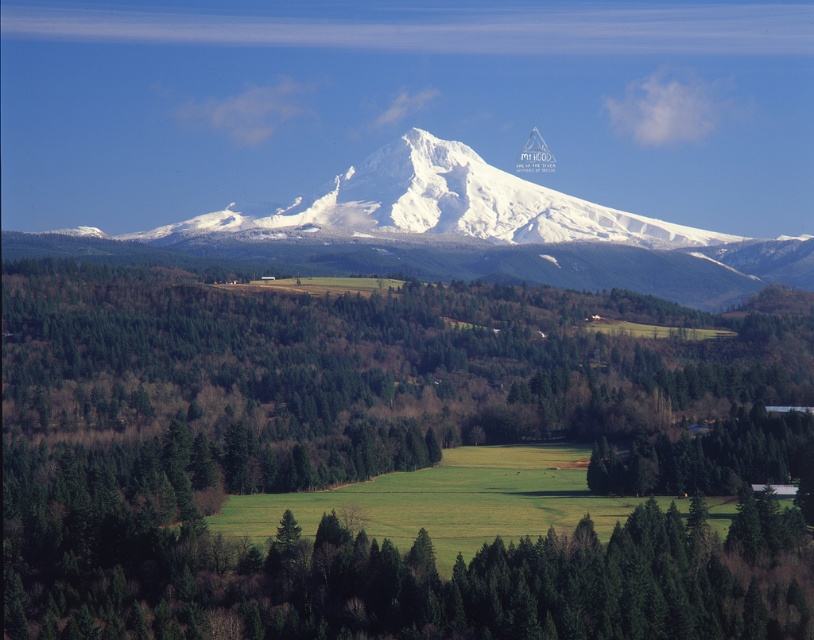
Question: Does green matte tree at center appear on the right side of white snow-covered mountain at center?

Choices:
 (A) yes
 (B) no

Answer: (A)

Question: Is green matte tree at center wider than white snow-covered mountain at center?

Choices:
 (A) yes
 (B) no

Answer: (B)

Question: Does green matte tree at center appear on the right side of white snow-covered mountain at center?

Choices:
 (A) yes
 (B) no

Answer: (A)

Question: Which object appears closest to the camera in this image?

Choices:
 (A) white snow-covered mountain at center
 (B) green matte tree at center

Answer: (B)